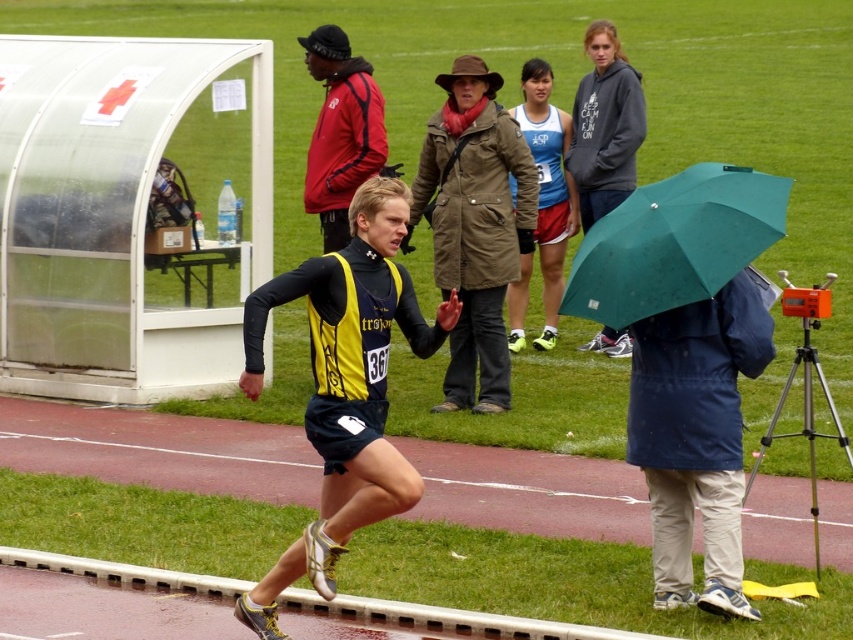
You are a runner in the race and you need to reach the finish line. There are two points marked on the track ahead of you. The first is at point (688,180) and the second is at point (553,246). Which point should you reach first based on their positions?

Based on their positions, point (688,180) is in front of point (553,246), so you should reach point (688,180) first.